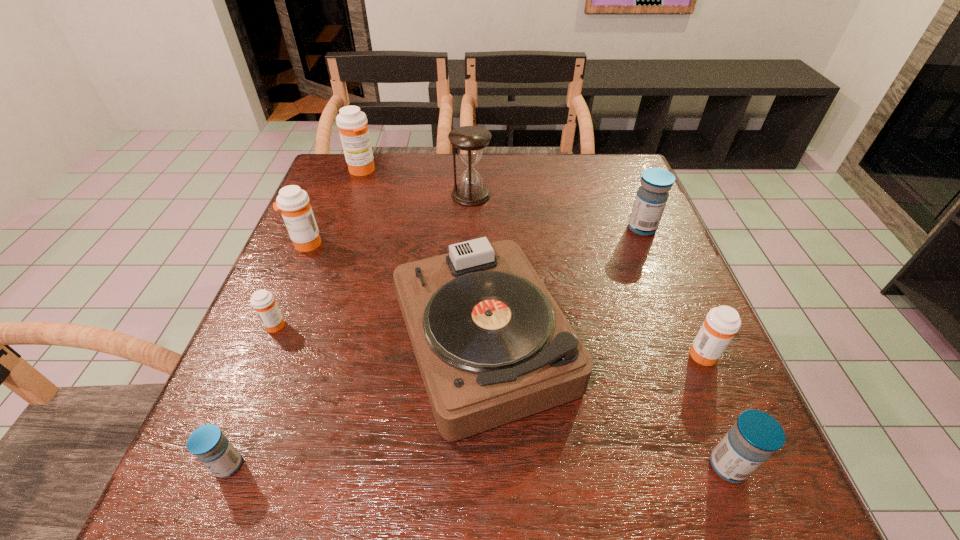
I want to click on the fourth nearest medicine, so click(263, 302).

The width and height of the screenshot is (960, 540). I want to click on the second nearest orange medicine, so click(263, 302).

Locate an element on the screen. This screenshot has height=540, width=960. free space located on the right of the farthest orange medicine is located at coordinates (514, 170).

The width and height of the screenshot is (960, 540). What are the coordinates of `vacant space situated on the right of the eighth nearest object` in the screenshot? It's located at (553, 195).

Where is `free space located 0.190m on the back of the farthest blue medicine`? The height and width of the screenshot is (540, 960). free space located 0.190m on the back of the farthest blue medicine is located at coordinates (621, 178).

Where is `free space located 0.340m on the front of the second farthest orange medicine`? The height and width of the screenshot is (540, 960). free space located 0.340m on the front of the second farthest orange medicine is located at coordinates (249, 379).

At what (x,y) coordinates should I click in order to perform the action: click on vacant region located 0.160m on the back of the record player. Please return your answer as a coordinate pair (x, y). This screenshot has height=540, width=960. Looking at the image, I should click on (483, 222).

Where is `vacant region located on the back of the nearest orange medicine`? vacant region located on the back of the nearest orange medicine is located at coordinates (662, 260).

Identify the location of free space located on the back of the second biggest blue medicine. The image size is (960, 540). (673, 325).

You are a GUI agent. You are given a task and a screenshot of the screen. Output one action in this format:
    pyautogui.click(x=<x>, y=<y>)
    Task: Click on the vacant point located 0.100m on the right of the leftmost blue medicine
    
    Given the screenshot: What is the action you would take?
    pyautogui.click(x=307, y=465)